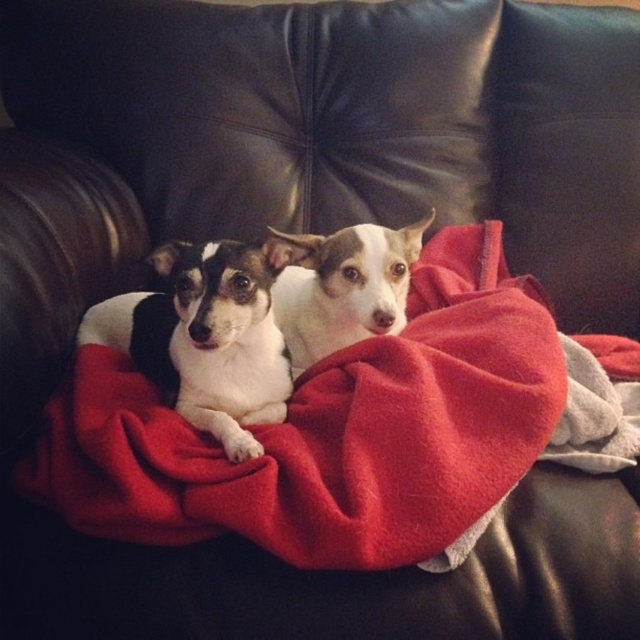
Who is higher up, red fleece blanket at center or black-and-white fur dog at center?

Positioned higher is black-and-white fur dog at center.

Describe the element at coordinates (328, 432) in the screenshot. I see `red fleece blanket at center` at that location.

Describe the element at coordinates (328, 432) in the screenshot. The height and width of the screenshot is (640, 640). I see `red fleece blanket at center` at that location.

Locate an element on the screen. The image size is (640, 640). red fleece blanket at center is located at coordinates (328, 432).

Who is taller, black-and-white fur dog at center or white fur dog at center?

With more height is white fur dog at center.

Can you confirm if black-and-white fur dog at center is bigger than white fur dog at center?

Actually, black-and-white fur dog at center might be smaller than white fur dog at center.

Is point (284, 266) farther from viewer compared to point (349, 256)?

No, it is not.

In order to click on black-and-white fur dog at center in this screenshot , I will do `click(205, 337)`.

Can you confirm if red fleece blanket at center is wider than white fur dog at center?

Indeed, red fleece blanket at center has a greater width compared to white fur dog at center.

Can you confirm if red fleece blanket at center is positioned above white fur dog at center?

No, red fleece blanket at center is not above white fur dog at center.

Is point (81, 467) farther from camera compared to point (308, 330)?

That is False.

The width and height of the screenshot is (640, 640). What are the coordinates of `red fleece blanket at center` in the screenshot? It's located at (328, 432).